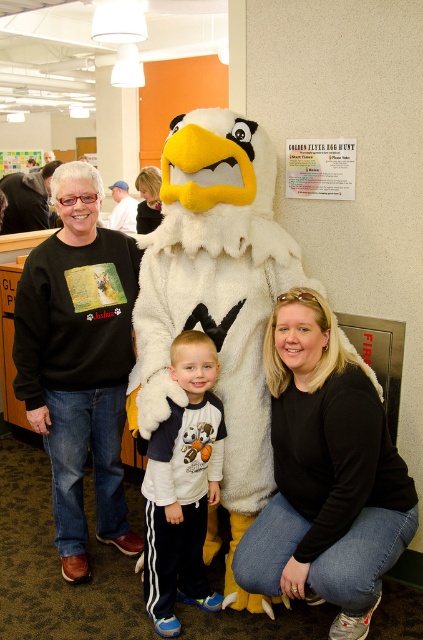
Measure the distance between black matte shirt at lower right and camera.

The distance of black matte shirt at lower right from camera is 5.36 feet.

Is black matte shirt at lower right below white fleece sweatshirt at center?

Incorrect, black matte shirt at lower right is not positioned below white fleece sweatshirt at center.

The width and height of the screenshot is (423, 640). Find the location of `black matte shirt at lower right`. black matte shirt at lower right is located at coordinates (326, 474).

Does white plush eagle at center have a greater width compared to white fleece sweatshirt at center?

Correct, the width of white plush eagle at center exceeds that of white fleece sweatshirt at center.

Is point (147, 416) positioned before point (195, 381)?

No, (147, 416) is further to viewer.

Does point (189, 177) lie in front of point (200, 401)?

Yes, it is in front of point (200, 401).

This screenshot has width=423, height=640. Identify the location of white plush eagle at center. (216, 296).

Does white fleece sweatshirt at center appear on the right side of matte black shirt at upper left?

Yes, white fleece sweatshirt at center is to the right of matte black shirt at upper left.

Can you confirm if white fleece sweatshirt at center is positioned below matte black shirt at upper left?

Indeed, white fleece sweatshirt at center is positioned under matte black shirt at upper left.

Between point (184, 435) and point (159, 189), which one is positioned behind?

The point (159, 189) is more distant.

You are a GUI agent. You are given a task and a screenshot of the screen. Output one action in this format:
    pyautogui.click(x=<x>, y=<y>)
    Task: Click on the white fleece sweatshirt at center
    This screenshot has width=423, height=640.
    Given the screenshot: What is the action you would take?
    pyautogui.click(x=183, y=486)